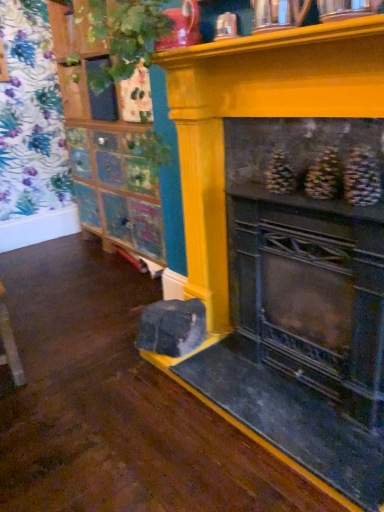
Locate an element on the screen. Image resolution: width=384 pixels, height=512 pixels. free space below yellow painted wood fireplace at center (from a real-world perspective) is located at coordinates (277, 376).